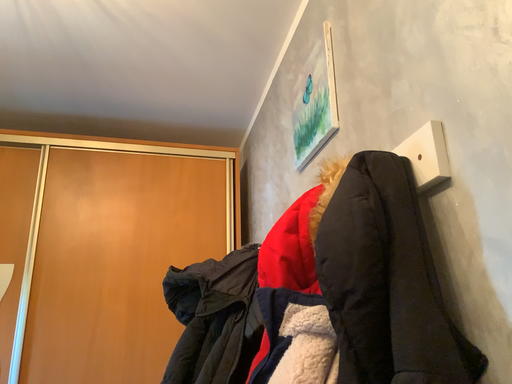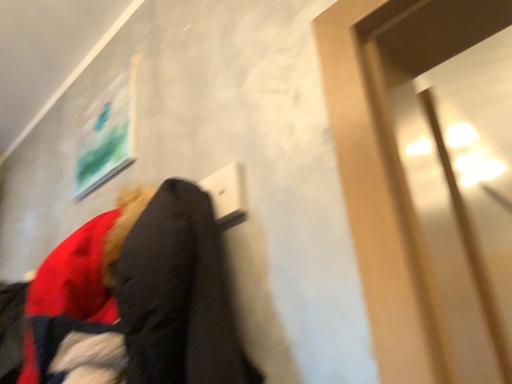
Question: How did the camera likely rotate when shooting the video?

Choices:
 (A) rotated left
 (B) rotated right

Answer: (B)